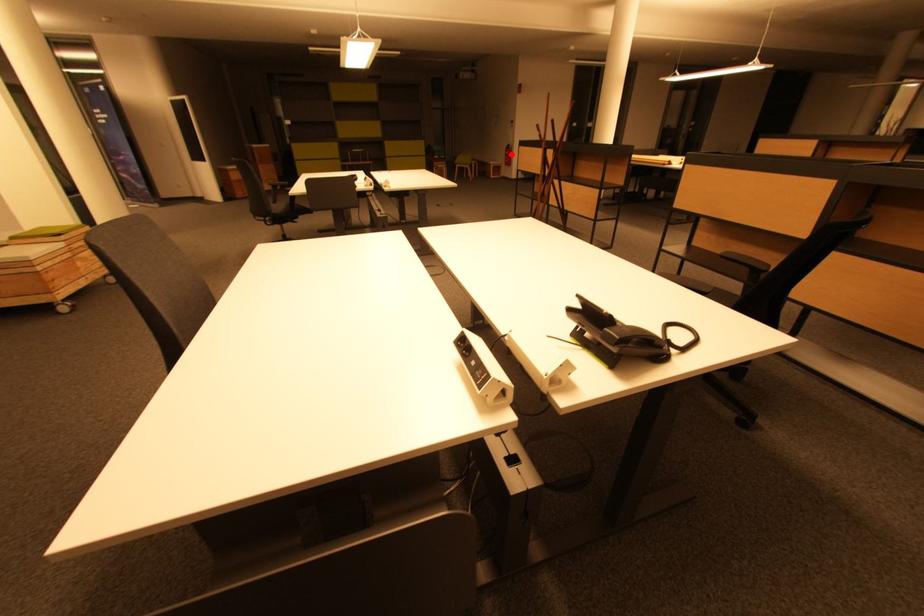
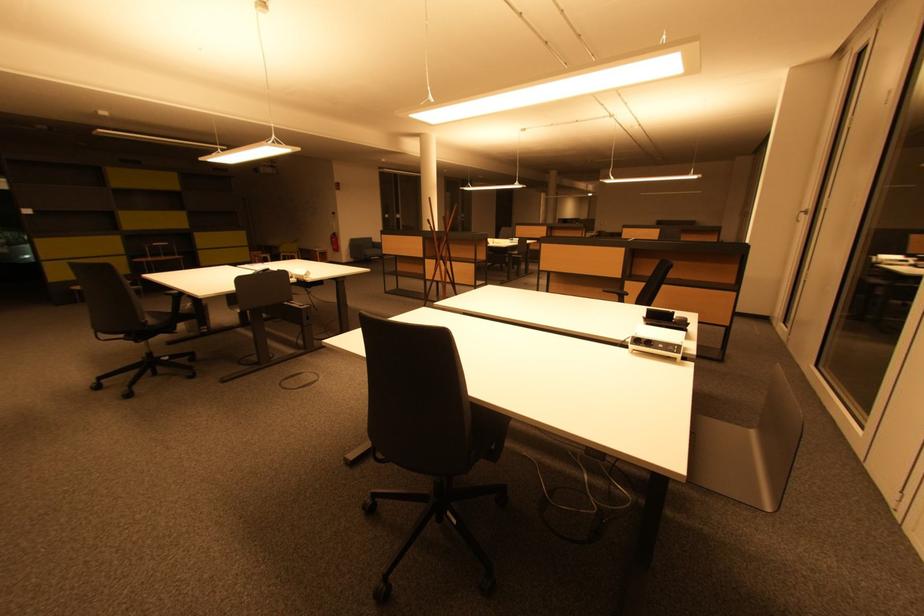
Question: A red point is marked in image1. In image2, is the corresponding 3D point closer to the camera or farther? Reply with the corresponding letter.

Choices:
 (A) The corresponding 3D point is closer.
 (B) The corresponding 3D point is farther.

Answer: (B)